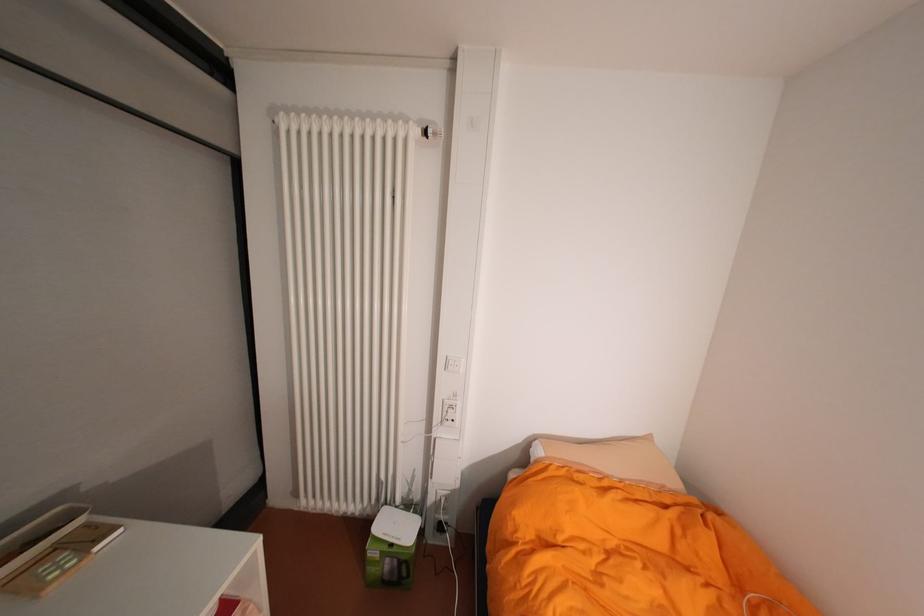
Which object does [38,538] point to?

It refers to a white tray.